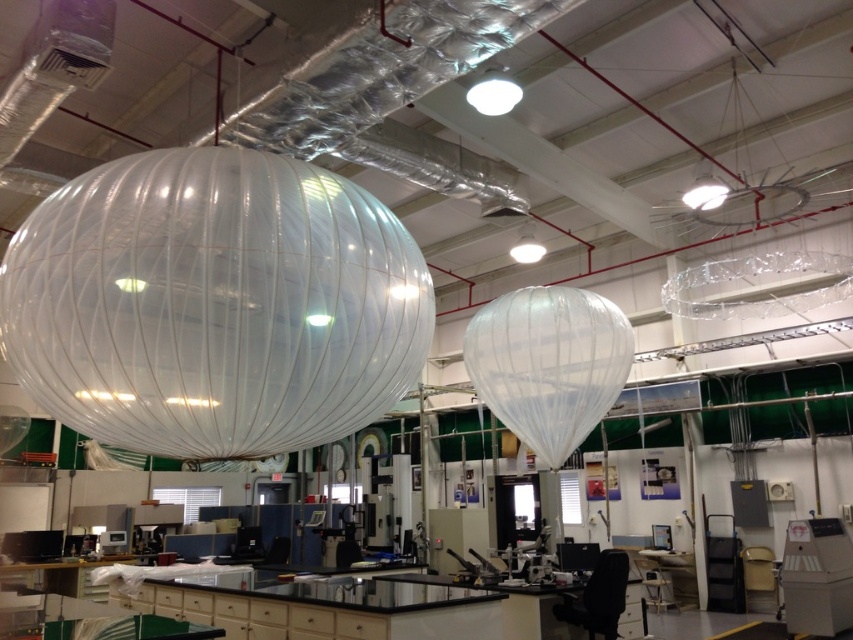
You are an engineer inspecting the laboratory. You need to determine which of the two balloons, the transparent plastic balloon at upper left or the transparent ribbed balloon at center, can hold more air. Based on their sizes, which one has a larger capacity?

The transparent ribbed balloon at center has a larger size than the transparent plastic balloon at upper left, so it can hold more air.

You are standing in the industrial or laboratory setting depicted in the image. You notice a point marked at coordinates (213, 305). What object does this point correspond to?

The point at (213, 305) corresponds to the transparent plastic balloon at upper left.

From the picture: You are standing in the industrial space and want to move from the transparent plastic balloon at upper left to the transparent plastic balloon at center. Can you walk directly between them without any obstacles?

The transparent plastic balloon at upper left is 10.15 meters away from transparent plastic balloon at center, so yes, you can walk directly between them without any obstacles since the distance is sufficient.